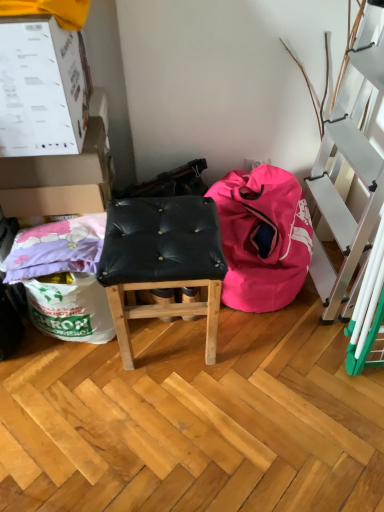
Question: Looking at the image, does white cardboard box at upper left, placed as the first box when sorted from front to back, seem bigger or smaller compared to black leather stool at center?

Choices:
 (A) small
 (B) big

Answer: (A)

Question: From the image's perspective, relative to black leather stool at center, is white cardboard box at upper left, the 2th box when ordered from back to front, above or below?

Choices:
 (A) below
 (B) above

Answer: (B)

Question: Which object is positioned farthest from the pink fabric bean bag at lower right?

Choices:
 (A) white cardboard box at upper left, the 2th box when ordered from back to front
 (B) white cardboard box at upper left, the 2th box viewed from the front
 (C) black leather stool at center

Answer: (A)

Question: Based on their relative distances, which object is nearer to the white cardboard box at upper left, placed as the first box when sorted from front to back?

Choices:
 (A) white cardboard box at upper left, the 2th box viewed from the front
 (B) pink fabric bean bag at lower right
 (C) black leather stool at center

Answer: (A)